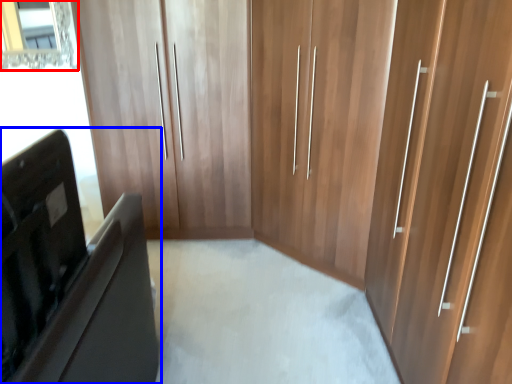
Question: Among these objects, which one is farthest to the camera, mirror (highlighted by a red box) or furniture (highlighted by a blue box)?

Choices:
 (A) mirror
 (B) furniture

Answer: (A)